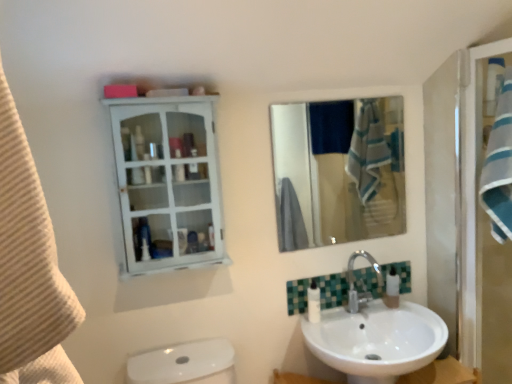
Image resolution: width=512 pixels, height=384 pixels. I want to click on white plastic soap dispenser at lower right, so click(392, 289).

Describe the element at coordinates (168, 182) in the screenshot. Image resolution: width=512 pixels, height=384 pixels. I see `white glossy cabinet at upper left` at that location.

In order to click on white glossy sink at lower right in this screenshot , I will do `click(374, 337)`.

Measure the distance between point (433,342) and camera.

Point (433,342) is 5.32 feet from camera.

Describe the element at coordinates (29, 267) in the screenshot. The image size is (512, 384). I see `beige textured towel at left` at that location.

Where is `blue striped towel at right`? The height and width of the screenshot is (384, 512). blue striped towel at right is located at coordinates (466, 214).

From the image's perspective, is polished chrome faucet at lower center positioned above or below white glossy lotion at lower center?

Clearly, from the image's perspective, polished chrome faucet at lower center is above white glossy lotion at lower center.

Is white glossy lotion at lower center a part of polished chrome faucet at lower center?

That's incorrect, white glossy lotion at lower center is not inside polished chrome faucet at lower center.

Between polished chrome faucet at lower center and white glossy lotion at lower center, which one has more height?

polished chrome faucet at lower center.

From a real-world perspective, relative to white glossy lotion at lower center, is polished chrome faucet at lower center vertically above or below?

polished chrome faucet at lower center is above white glossy lotion at lower center.

From a real-world perspective, who is located higher, beige textured towel at left or white glossy sink at lower right?

beige textured towel at left, from a real-world perspective.

Which is in front, beige textured towel at left or white glossy sink at lower right?

beige textured towel at left is closer to the camera.

Which is closer, (50, 276) or (404, 277)?

Clearly, point (50, 276) is closer to the camera than point (404, 277).

From the image's perspective, would you say white glossy sink at lower right is positioned over beige textured towel at left?

No, from the image's perspective, white glossy sink at lower right is not on top of beige textured towel at left.

Considering the relative positions of white glossy sink at lower right and beige textured towel at left in the image provided, is white glossy sink at lower right behind beige textured towel at left?

Yes, the depth of white glossy sink at lower right is greater than that of beige textured towel at left.

What's the angular difference between white glossy sink at lower right and beige textured towel at left's facing directions?

89.3 degrees.

Considering the sizes of white glossy sink at lower right and beige textured towel at left in the image, is white glossy sink at lower right wider or thinner than beige textured towel at left?

Considering their sizes, white glossy sink at lower right looks broader than beige textured towel at left.

Could blue striped towel at right be considered to be inside white glossy sink at lower right?

No.

Measure the distance from white glossy sink at lower right to blue striped towel at right.

white glossy sink at lower right is 16.25 inches away from blue striped towel at right.

Does white glossy sink at lower right appear on the left side of blue striped towel at right?

Yes, white glossy sink at lower right is to the left of blue striped towel at right.

Is point (191, 265) in front of point (396, 285)?

Yes, point (191, 265) is closer to viewer.

The width and height of the screenshot is (512, 384). I want to click on bathroom cabinet above the white plastic soap dispenser at lower right (from a real-world perspective), so click(168, 182).

How far apart are white glossy cabinet at upper left and white plastic soap dispenser at lower right?

white glossy cabinet at upper left and white plastic soap dispenser at lower right are 1.05 meters apart from each other.

Considering the sizes of objects white glossy cabinet at upper left and white plastic soap dispenser at lower right in the image provided, who is taller, white glossy cabinet at upper left or white plastic soap dispenser at lower right?

Standing taller between the two is white glossy cabinet at upper left.

Is blue striped towel at right inside or outside of polished chrome faucet at lower center?

blue striped towel at right lies outside polished chrome faucet at lower center.

From the image's perspective, relative to polished chrome faucet at lower center, is blue striped towel at right above or below?

Clearly, from the image's perspective, blue striped towel at right is above polished chrome faucet at lower center.

Is blue striped towel at right taller or shorter than polished chrome faucet at lower center?

In the image, blue striped towel at right appears to be taller than polished chrome faucet at lower center.

From a real-world perspective, who is located higher, blue striped towel at right or polished chrome faucet at lower center?

blue striped towel at right is physically above.

This screenshot has height=384, width=512. I want to click on soap dispenser below the white glossy cabinet at upper left (from the image's perspective), so click(x=392, y=289).

From the image's perspective, who appears lower, white plastic soap dispenser at lower right or white glossy cabinet at upper left?

From the image's view, white plastic soap dispenser at lower right is below.

Does white plastic soap dispenser at lower right have a smaller size compared to white glossy cabinet at upper left?

Correct, white plastic soap dispenser at lower right occupies less space than white glossy cabinet at upper left.

Between white plastic soap dispenser at lower right and white glossy cabinet at upper left, which one has more height?

With more height is white glossy cabinet at upper left.

Find the location of a particular element. tap above the white glossy lotion at lower center (from a real-world perspective) is located at coordinates (354, 281).

The height and width of the screenshot is (384, 512). I want to click on sink located behind the beige textured towel at left, so click(374, 337).

Estimate the real-world distances between objects in this image. Which object is closer to beige textured towel at left, blue striped towel at right or white glossy lotion at lower center?

white glossy lotion at lower center.

Based on their spatial positions, is blue striped towel at right or polished chrome faucet at lower center further from white glossy sink at lower right?

blue striped towel at right.

From the image, which object appears to be farther from white plastic soap dispenser at lower right, beige textured towel at left or white glossy cabinet at upper left?

The object further to white plastic soap dispenser at lower right is beige textured towel at left.

Based on their spatial positions, is white plastic soap dispenser at lower right or polished chrome faucet at lower center closer to blue striped towel at right?

white plastic soap dispenser at lower right is closer to blue striped towel at right.

Based on their spatial positions, is polished chrome faucet at lower center or blue striped towel at right further from white glossy cabinet at upper left?

blue striped towel at right lies further to white glossy cabinet at upper left than the other object.

Which object lies nearer to the anchor point blue striped towel at right, beige textured towel at left or white glossy cabinet at upper left?

Among the two, white glossy cabinet at upper left is located nearer to blue striped towel at right.

Considering their positions, is beige textured towel at left positioned closer to white glossy cabinet at upper left than polished chrome faucet at lower center?

Among the two, polished chrome faucet at lower center is located nearer to white glossy cabinet at upper left.

From the image, which object appears to be nearer to white glossy sink at lower right, white plastic soap dispenser at lower right or polished chrome faucet at lower center?

polished chrome faucet at lower center is positioned closer to the anchor white glossy sink at lower right.

This screenshot has height=384, width=512. In order to click on screen door located between beige textured towel at left and white glossy lotion at lower center in the depth direction in this screenshot , I will do `click(466, 214)`.

In order to click on sink located between white glossy lotion at lower center and blue striped towel at right in the left-right direction in this screenshot , I will do `click(374, 337)`.

In order to click on tap between white glossy cabinet at upper left and white plastic soap dispenser at lower right in the horizontal direction in this screenshot , I will do `click(354, 281)`.

Identify the location of bathroom cabinet located between beige textured towel at left and white plastic soap dispenser at lower right in the depth direction. (168, 182).